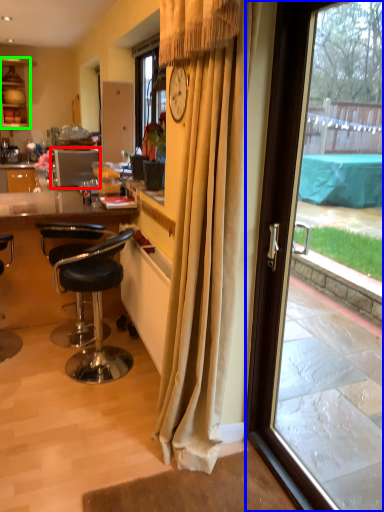
Question: Which object is positioned farthest from kitchen appliance (highlighted by a red box)? Select from door (highlighted by a blue box) and cabinetry (highlighted by a green box).

Choices:
 (A) door
 (B) cabinetry

Answer: (A)